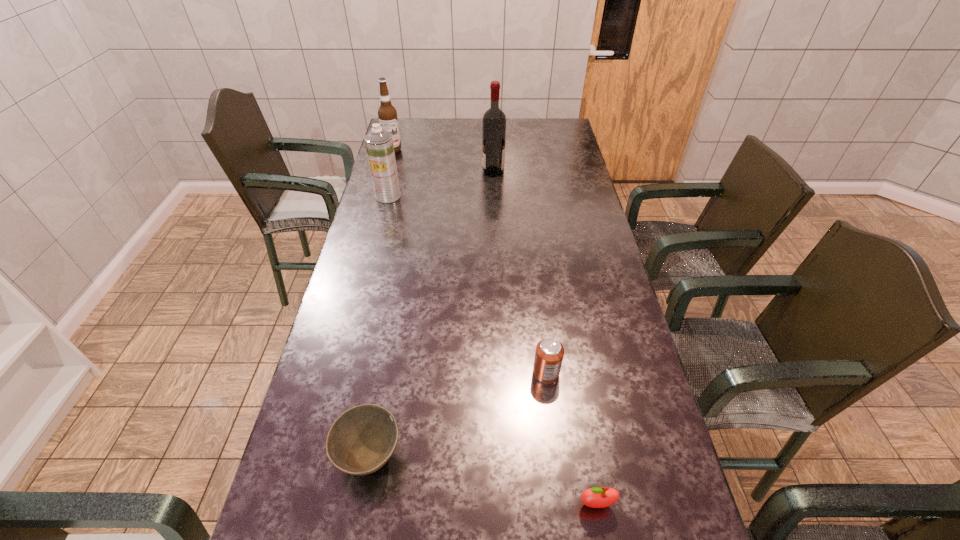
Find the location of a particular element. free spot located on the front and back of the third object from right to left is located at coordinates (448, 172).

I want to click on free space located 0.250m on the label of the farthest object, so click(x=383, y=187).

Image resolution: width=960 pixels, height=540 pixels. I want to click on vacant space situated 0.320m on the right of the aerosol can, so click(x=484, y=196).

Where is `free space located on the back of the fourth farthest object`? free space located on the back of the fourth farthest object is located at coordinates click(537, 298).

Locate an element on the screen. The image size is (960, 540). free space located 0.350m on the back of the second nearest object is located at coordinates (396, 312).

You are a GUI agent. You are given a task and a screenshot of the screen. Output one action in this format:
    pyautogui.click(x=<x>, y=<y>)
    Task: Click on the free space located on the left of the apple
    The width and height of the screenshot is (960, 540).
    Given the screenshot: What is the action you would take?
    pyautogui.click(x=478, y=504)

Where is `alcohol that is at the left edge`? The height and width of the screenshot is (540, 960). alcohol that is at the left edge is located at coordinates (387, 114).

In order to click on aerosol can located in the left edge section of the desktop in this screenshot , I will do `click(379, 145)`.

At what (x,y) coordinates should I click in order to perform the action: click on bowl present at the left edge. Please return your answer as a coordinate pair (x, y). The height and width of the screenshot is (540, 960). Looking at the image, I should click on (362, 439).

Find the location of a particular element. The height and width of the screenshot is (540, 960). object located at the right edge is located at coordinates (597, 497).